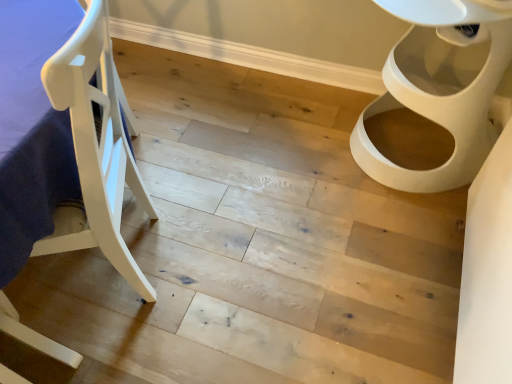
I want to click on white wood chair at left, so click(x=95, y=147).

What do you see at coordinates (95, 147) in the screenshot? I see `white wood chair at left` at bounding box center [95, 147].

What do you see at coordinates (441, 86) in the screenshot? The width and height of the screenshot is (512, 384). I see `white glossy toilet at right` at bounding box center [441, 86].

Locate an element on the screen. white glossy toilet at right is located at coordinates (441, 86).

Measure the distance between point (470,107) and camera.

The distance of point (470,107) from camera is 1.36 meters.

Where is `white wood chair at left`? white wood chair at left is located at coordinates (95, 147).

Which object is positioned more to the right, white glossy toilet at right or white wood chair at left?

From the viewer's perspective, white glossy toilet at right appears more on the right side.

Does white glossy toilet at right come behind white wood chair at left?

Yes.

Is point (388, 100) closer to viewer compared to point (76, 59)?

That is False.

In the scene shown: From the image's perspective, is white glossy toilet at right above white wood chair at left?

Correct, white glossy toilet at right appears higher than white wood chair at left in the image.

From a real-world perspective, is white glossy toilet at right below white wood chair at left?

Indeed, from a real-world perspective, white glossy toilet at right is positioned beneath white wood chair at left.

Can you confirm if white glossy toilet at right is wider than white wood chair at left?

In fact, white glossy toilet at right might be narrower than white wood chair at left.

Between white glossy toilet at right and white wood chair at left, which one has less height?

With less height is white glossy toilet at right.

Who is bigger, white glossy toilet at right or white wood chair at left?

white wood chair at left.

Would you say white glossy toilet at right contains white wood chair at left?

No, white wood chair at left is located outside of white glossy toilet at right.

Are white glossy toilet at right and white wood chair at left making contact?

No, white glossy toilet at right is not making contact with white wood chair at left.

Does white glossy toilet at right turn towards white wood chair at left?

No, white glossy toilet at right is not aimed at white wood chair at left.

You are a GUI agent. You are given a task and a screenshot of the screen. Output one action in this format:
    pyautogui.click(x=<x>, y=<y>)
    Task: Click on the furniture that appears below the white glossy toilet at right (from the image's perspective)
    The width and height of the screenshot is (512, 384).
    Given the screenshot: What is the action you would take?
    pyautogui.click(x=95, y=147)

From the picture: Considering the positions of objects white wood chair at left and white glossy toilet at right in the image provided, who is more to the right, white wood chair at left or white glossy toilet at right?

Positioned to the right is white glossy toilet at right.

Who is more distant, white wood chair at left or white glossy toilet at right?

white glossy toilet at right is further away from the camera.

Which point is more distant from viewer, (132, 180) or (436, 111)?

The point (132, 180) is farther.

From the image's perspective, is white wood chair at left located above or below white glossy toilet at right?

white wood chair at left is situated lower than white glossy toilet at right in the image.

From a real-world perspective, is white wood chair at left located beneath white glossy toilet at right?

No, from a real-world perspective, white wood chair at left is not under white glossy toilet at right.

Considering the sizes of objects white wood chair at left and white glossy toilet at right in the image provided, who is thinner, white wood chair at left or white glossy toilet at right?

white glossy toilet at right.

Between white wood chair at left and white glossy toilet at right, which one has more height?

Standing taller between the two is white wood chair at left.

Which of these two, white wood chair at left or white glossy toilet at right, is smaller?

With smaller size is white glossy toilet at right.

Is white wood chair at left positioned beyond the bounds of white glossy toilet at right?

white wood chair at left is positioned outside white glossy toilet at right.

Is white wood chair at left touching white glossy toilet at right?

No.

Does white wood chair at left turn towards white glossy toilet at right?

No, white wood chair at left is not aimed at white glossy toilet at right.

Can you tell me how much white wood chair at left and white glossy toilet at right differ in facing direction?

0.0286 degrees separate the facing orientations of white wood chair at left and white glossy toilet at right.

How far apart are white wood chair at left and white glossy toilet at right?

3.30 feet.

Where is `furniture in front of the white glossy toilet at right`? The height and width of the screenshot is (384, 512). furniture in front of the white glossy toilet at right is located at coordinates click(95, 147).

At what (x,y) coordinates should I click in order to perform the action: click on furniture located in front of the white glossy toilet at right. Please return your answer as a coordinate pair (x, y). Looking at the image, I should click on point(95,147).

The image size is (512, 384). I want to click on toilet below the white wood chair at left (from a real-world perspective), so click(441, 86).